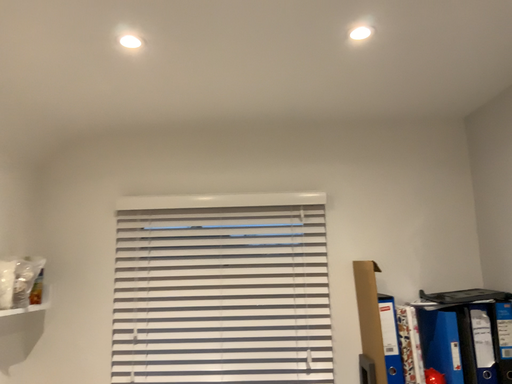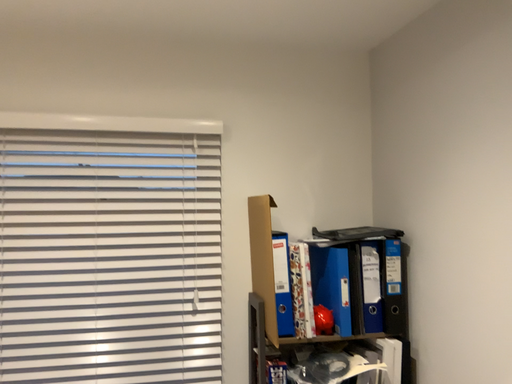
Question: Which way did the camera rotate in the video?

Choices:
 (A) rotated downward
 (B) rotated upward

Answer: (A)